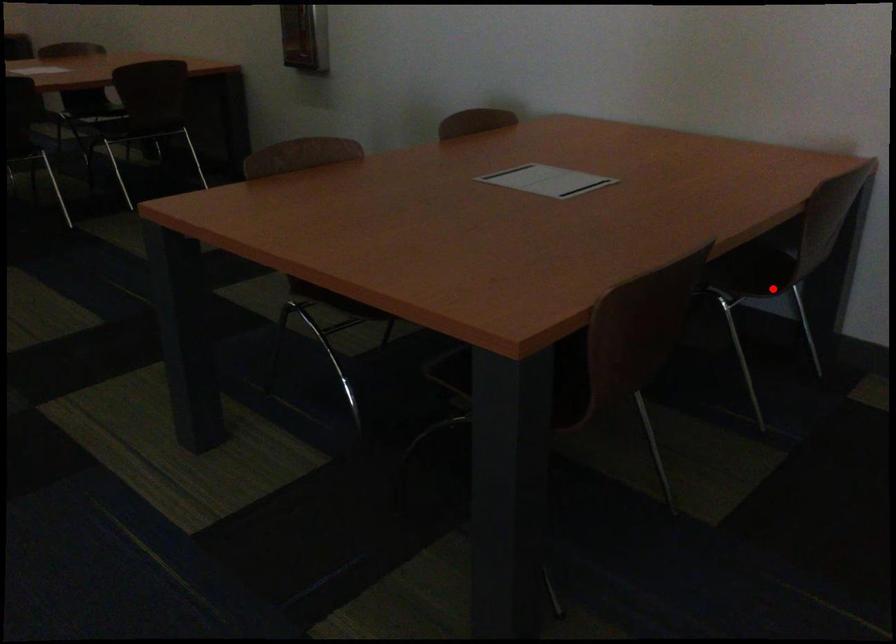
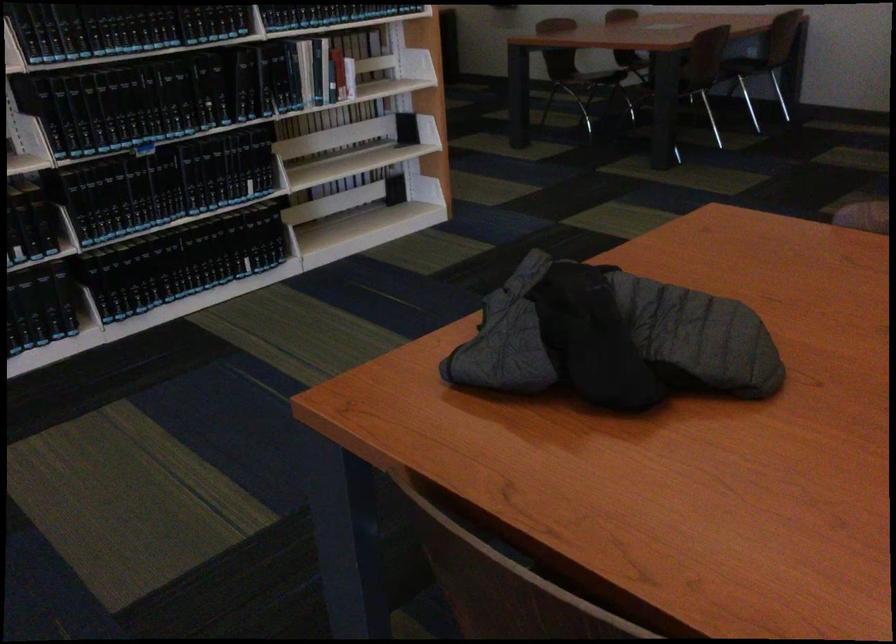
Question: I am providing you with two images of the same scene from different viewpoints. Given a red point in image1, look at the same physical point in image2. Is it:

Choices:
 (A) Closer to the viewpoint
 (B) Farther from the viewpoint

Answer: (B)